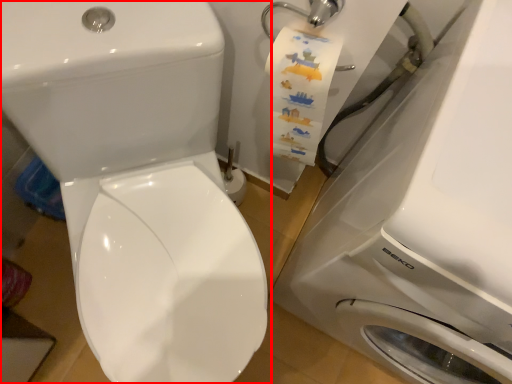
Question: From the image's perspective, what is the correct spatial relationship of toilet (annotated by the red box) in relation to washing machine?

Choices:
 (A) below
 (B) above

Answer: (B)